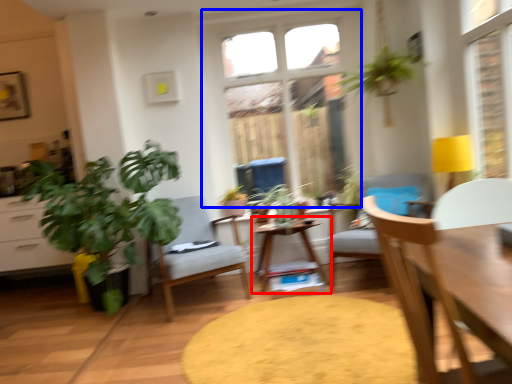
Question: Which object is closer to the camera taking this photo, table (highlighted by a red box) or window (highlighted by a blue box)?

Choices:
 (A) table
 (B) window

Answer: (A)